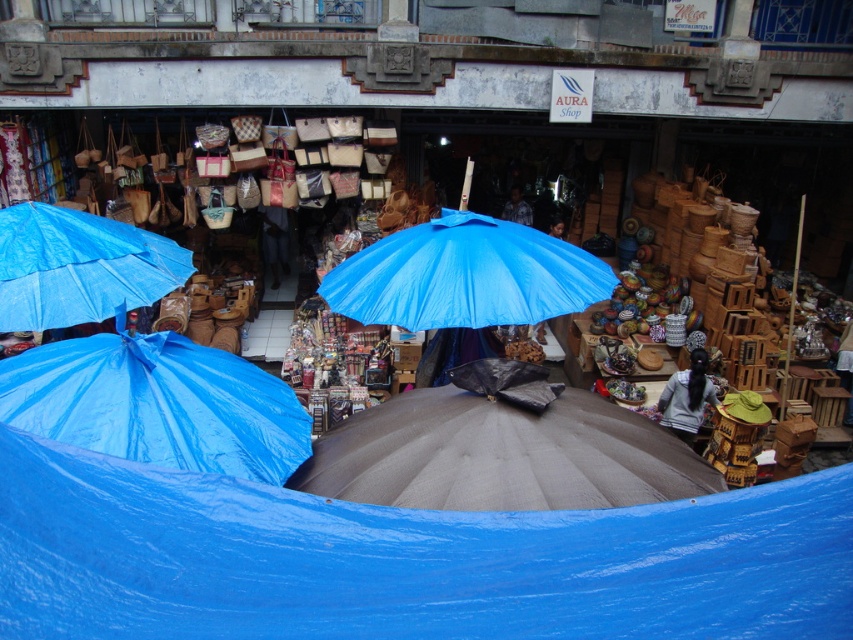
Question: Considering the relative positions of blue tarpaulin umbrella at left and blue tarpaulin umbrella at center in the image provided, where is blue tarpaulin umbrella at left located with respect to blue tarpaulin umbrella at center?

Choices:
 (A) left
 (B) right

Answer: (A)

Question: Which object is the farthest from the blue tarpaulin umbrella at center?

Choices:
 (A) blue tarp at center
 (B) blue tarpaulin umbrella at upper left
 (C) gray fabric umbrella at center
 (D) blue tarpaulin umbrella at left

Answer: (A)

Question: Is blue tarp at center in front of gray fabric umbrella at center?

Choices:
 (A) no
 (B) yes

Answer: (B)

Question: Which of the following is the closest to the observer?

Choices:
 (A) (682, 612)
 (B) (498, 307)
 (C) (639, 445)

Answer: (A)

Question: Is the position of gray fabric umbrella at center more distant than that of blue tarpaulin umbrella at left?

Choices:
 (A) yes
 (B) no

Answer: (B)

Question: Which object is closer to the camera taking this photo?

Choices:
 (A) blue tarp at center
 (B) blue tarpaulin umbrella at left
 (C) blue tarpaulin umbrella at center

Answer: (A)